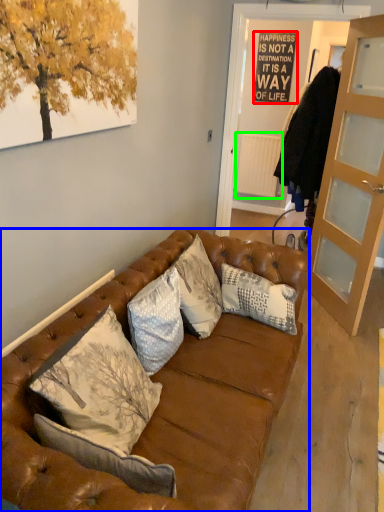
Question: Which object is positioned farthest from bulletin board (highlighted by a red box)? Select from studio couch (highlighted by a blue box) and radiator (highlighted by a green box).

Choices:
 (A) studio couch
 (B) radiator

Answer: (A)